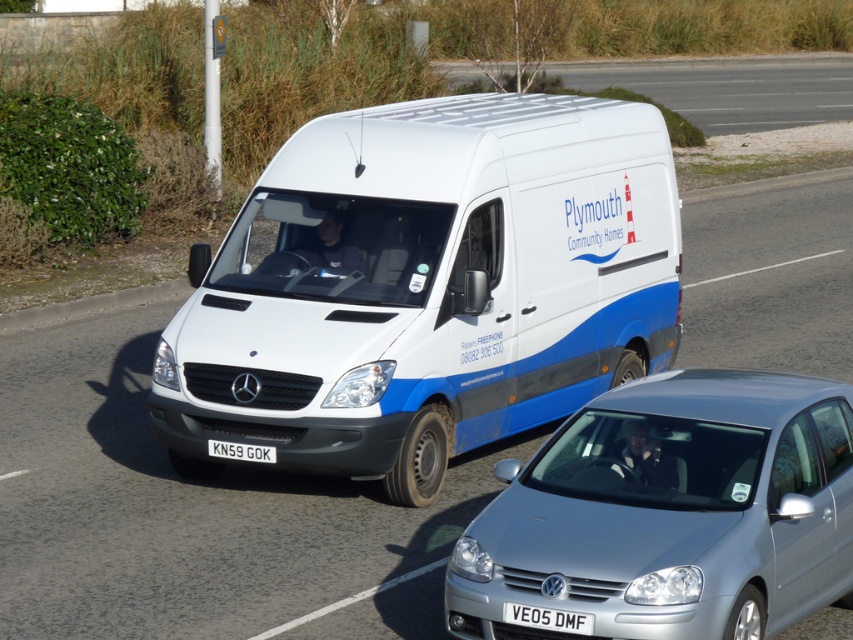
Question: Is white plastic license plate at center above black plastic license plate at center?

Choices:
 (A) yes
 (B) no

Answer: (B)

Question: Which of the following is the farthest from the observer?

Choices:
 (A) silver metallic car at lower right
 (B) black plastic license plate at center

Answer: (B)

Question: Which point appears farthest from the camera in this image?

Choices:
 (A) click(238, 456)
 (B) click(380, 374)

Answer: (A)

Question: Does silver metallic car at lower right have a greater width compared to black plastic license plate at center?

Choices:
 (A) no
 (B) yes

Answer: (B)

Question: Can you confirm if white matte van at center is smaller than white plastic license plate at center?

Choices:
 (A) yes
 (B) no

Answer: (B)

Question: Which point is farther to the camera?

Choices:
 (A) (482, 440)
 (B) (555, 611)

Answer: (A)